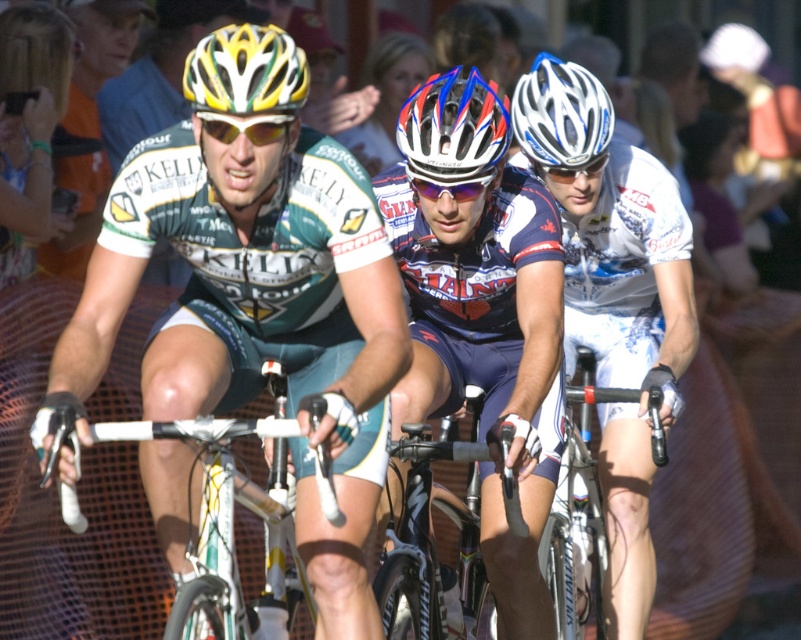
Can you confirm if shiny blue jersey at center is positioned above white matte bicycle helmet at center?

No, shiny blue jersey at center is not above white matte bicycle helmet at center.

Can you confirm if shiny blue jersey at center is positioned below white matte bicycle helmet at center?

Correct, shiny blue jersey at center is located below white matte bicycle helmet at center.

Is point (510, 467) more distant than point (590, 150)?

That is False.

What are the coordinates of `shiny blue jersey at center` in the screenshot? It's located at (482, 314).

This screenshot has width=801, height=640. What do you see at coordinates (429, 531) in the screenshot?
I see `shiny metallic bicycle at center` at bounding box center [429, 531].

Which is behind, point (469, 536) or point (268, 81)?

Point (469, 536)

Identify the location of shiny metallic bicycle at center. (429, 531).

Looking at this image, is white/blue/red glossy bicycle helmet at center thinner than yellow reflective lens glasses at center?

Incorrect, white/blue/red glossy bicycle helmet at center's width is not less than yellow reflective lens glasses at center's.

This screenshot has width=801, height=640. What are the coordinates of `white/blue/red glossy bicycle helmet at center` in the screenshot? It's located at (453, 128).

Which is behind, point (471, 148) or point (196, 109)?

The point (471, 148) is behind.

You are a GUI agent. You are given a task and a screenshot of the screen. Output one action in this format:
    pyautogui.click(x=<x>, y=<y>)
    Task: Click on the white/blue/red glossy bicycle helmet at center
    This screenshot has height=640, width=801.
    Given the screenshot: What is the action you would take?
    pyautogui.click(x=453, y=128)